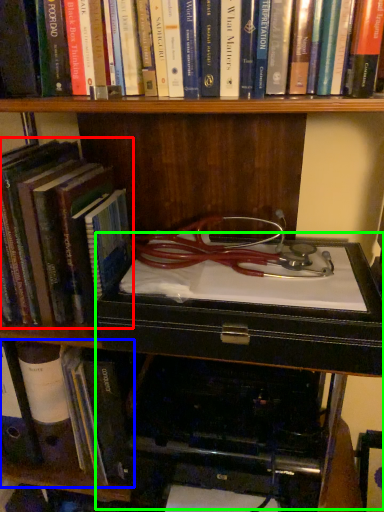
Question: Based on their relative distances, which object is nearer to book (highlighted by a red box)? Choose from book (highlighted by a blue box) and table (highlighted by a green box).

Choices:
 (A) book
 (B) table

Answer: (B)